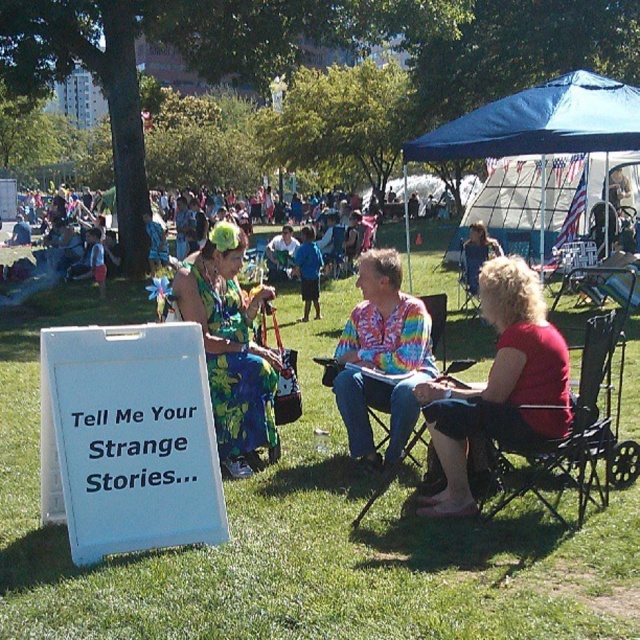
Is white paper sign at lower left to the right of blue fabric canopy at upper center from the viewer's perspective?

Incorrect, white paper sign at lower left is not on the right side of blue fabric canopy at upper center.

Is point (209, 451) less distant than point (532, 129)?

Yes.

At what (x,y) coordinates should I click in order to perform the action: click on white paper sign at lower left. Please return your answer as a coordinate pair (x, y). This screenshot has width=640, height=640. Looking at the image, I should click on [132, 436].

Who is more distant from viewer, (104, 362) or (433, 131)?

The point (433, 131) is more distant.

This screenshot has width=640, height=640. What do you see at coordinates (132, 436) in the screenshot?
I see `white paper sign at lower left` at bounding box center [132, 436].

The image size is (640, 640). I want to click on white paper sign at lower left, so click(132, 436).

What are the coordinates of `white paper sign at lower left` in the screenshot? It's located at 132,436.

Is white paper sign at lower left to the left of red cotton shirt at center from the viewer's perspective?

Correct, you'll find white paper sign at lower left to the left of red cotton shirt at center.

Can you confirm if white paper sign at lower left is taller than red cotton shirt at center?

No, white paper sign at lower left is not taller than red cotton shirt at center.

Which is in front, point (166, 378) or point (541, 371)?

Point (166, 378)

Find the location of `white paper sign at lower left`. white paper sign at lower left is located at coordinates (132, 436).